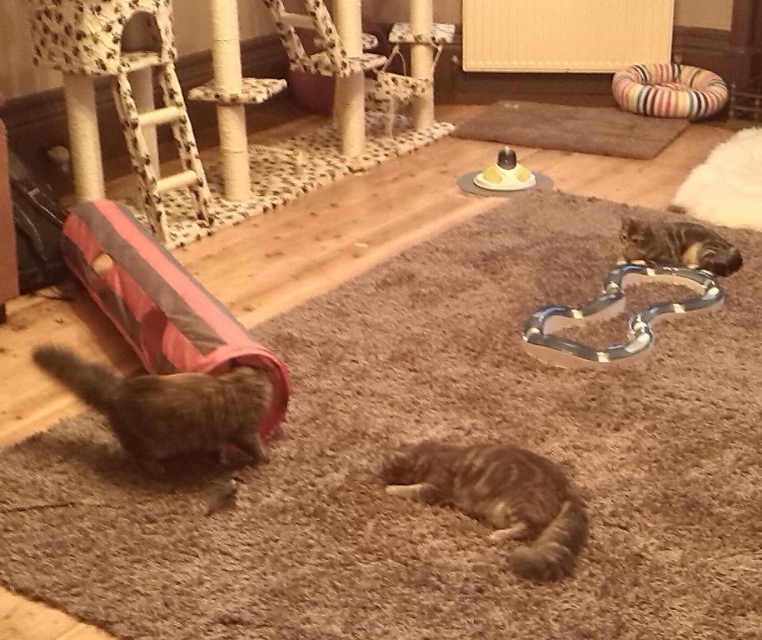
You are a cat owner who wants to ensure the safety of your pets. Looking at the image, can you determine if the gray tabby cat at center is near the metallic silver chain at upper right?

The gray tabby cat at center is in front of the metallic silver chain at upper right, so yes, the cat is near the chain.

You are a cat owner who wants to hang a small bird toy from the ceiling. You notice the metallic silver chain at upper right and the yellow rubber ring at center. Which object is positioned lower and could be a better anchor point for hanging the toy?

The metallic silver chain at upper right is located below the yellow rubber ring at center, making it the better anchor point for hanging the toy since it is lower and closer to where the toy would be suspended.